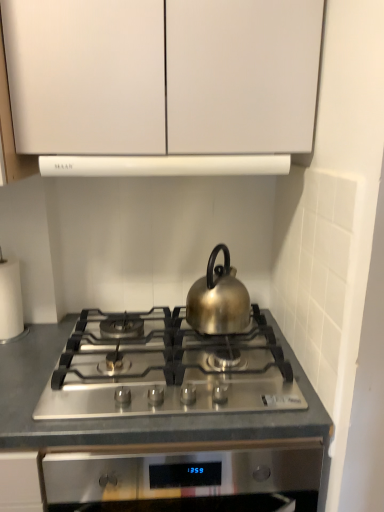
Question: Is shiny metallic kettle at center not inside white paper at left?

Choices:
 (A) no
 (B) yes

Answer: (B)

Question: Is shiny metallic kettle at center thinner than white paper at left?

Choices:
 (A) no
 (B) yes

Answer: (A)

Question: From the image's perspective, does shiny metallic kettle at center appear higher than white paper at left?

Choices:
 (A) no
 (B) yes

Answer: (B)

Question: From a real-world perspective, is shiny metallic kettle at center positioned under white paper at left based on gravity?

Choices:
 (A) no
 (B) yes

Answer: (A)

Question: Is shiny metallic kettle at center taller than white paper at left?

Choices:
 (A) no
 (B) yes

Answer: (A)

Question: From a real-world perspective, relative to white matte exhaust hood at upper center, is satin silver gas stove at center vertically above or below?

Choices:
 (A) below
 (B) above

Answer: (A)

Question: Is satin silver gas stove at center wider or thinner than white matte exhaust hood at upper center?

Choices:
 (A) wide
 (B) thin

Answer: (A)

Question: Is point (259, 408) closer or farther from the camera than point (216, 167)?

Choices:
 (A) closer
 (B) farther

Answer: (A)

Question: Would you say satin silver gas stove at center is inside or outside white matte exhaust hood at upper center?

Choices:
 (A) inside
 (B) outside

Answer: (B)

Question: From the image's perspective, is stainless steel cooktop at center above or below white matte exhaust hood at upper center?

Choices:
 (A) below
 (B) above

Answer: (A)

Question: Considering the positions of stainless steel cooktop at center and white matte exhaust hood at upper center in the image, is stainless steel cooktop at center bigger or smaller than white matte exhaust hood at upper center?

Choices:
 (A) big
 (B) small

Answer: (A)

Question: Is point (251, 428) closer or farther from the camera than point (213, 175)?

Choices:
 (A) farther
 (B) closer

Answer: (B)

Question: Is stainless steel cooktop at center taller or shorter than white matte exhaust hood at upper center?

Choices:
 (A) tall
 (B) short

Answer: (A)

Question: Visually, is white matte exhaust hood at upper center positioned to the left or to the right of white paper at left?

Choices:
 (A) right
 (B) left

Answer: (A)

Question: Considering their positions, is white matte exhaust hood at upper center located in front of or behind white paper at left?

Choices:
 (A) behind
 (B) front

Answer: (B)